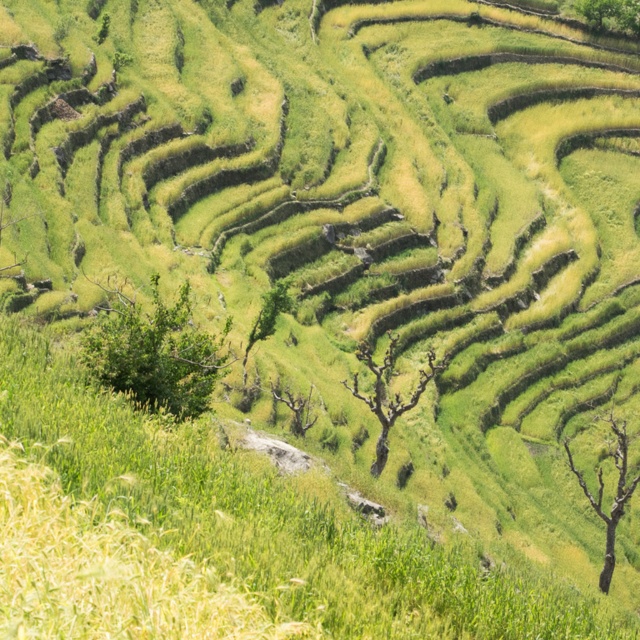
Can you confirm if bare wood tree at center is wider than green leafy tree at left?

Yes.

Is point (380, 436) closer to camera compared to point (10, 289)?

That is False.

Find the location of a particular element. bare wood tree at center is located at coordinates (387, 396).

Does point (614, 460) come closer to viewer compared to point (611, 22)?

Yes, point (614, 460) is in front of point (611, 22).

Which is below, bare wood tree at center-right or green leafy tree at upper right?

bare wood tree at center-right

Measure the distance between point (600, 506) and camera.

Point (600, 506) is 206.88 feet away from camera.

Find the location of a particular element. bare wood tree at center-right is located at coordinates (612, 497).

Is point (113, 388) positioned after point (614, 428)?

No, it is not.

The width and height of the screenshot is (640, 640). Find the location of `green leafy tree at center`. green leafy tree at center is located at coordinates (156, 353).

What do you see at coordinates (156, 353) in the screenshot? This screenshot has width=640, height=640. I see `green leafy tree at center` at bounding box center [156, 353].

Locate an element on the screen. green leafy tree at center is located at coordinates (156, 353).